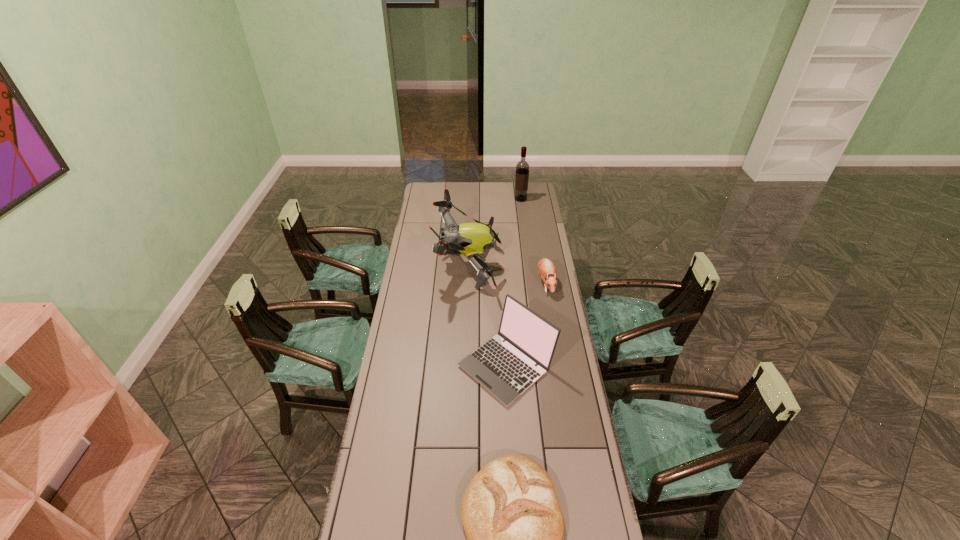
Image resolution: width=960 pixels, height=540 pixels. I want to click on the farthest object, so click(522, 168).

In order to click on drone in this screenshot , I will do `click(470, 239)`.

This screenshot has height=540, width=960. Identify the location of laptop_computer. (506, 369).

Identify the location of the third shortest object. The width and height of the screenshot is (960, 540). point(506,369).

Identify the location of hamster. Image resolution: width=960 pixels, height=540 pixels. (546, 269).

What are the coordinates of `free spot located on the front of the wine bottle` in the screenshot? It's located at [521, 207].

Where is `vacant position located on the front-facing side of the drone`? vacant position located on the front-facing side of the drone is located at coordinates (540, 265).

At what (x,y) coordinates should I click in order to perform the action: click on free space located at the front screen of the laptop_computer. Please return your answer as a coordinate pair (x, y). The image size is (960, 540). Looking at the image, I should click on 410,366.

Where is `vacant area situated at the front screen of the laptop_computer`? This screenshot has width=960, height=540. vacant area situated at the front screen of the laptop_computer is located at coordinates (413, 366).

I want to click on vacant space situated at the front screen of the laptop_computer, so click(x=405, y=366).